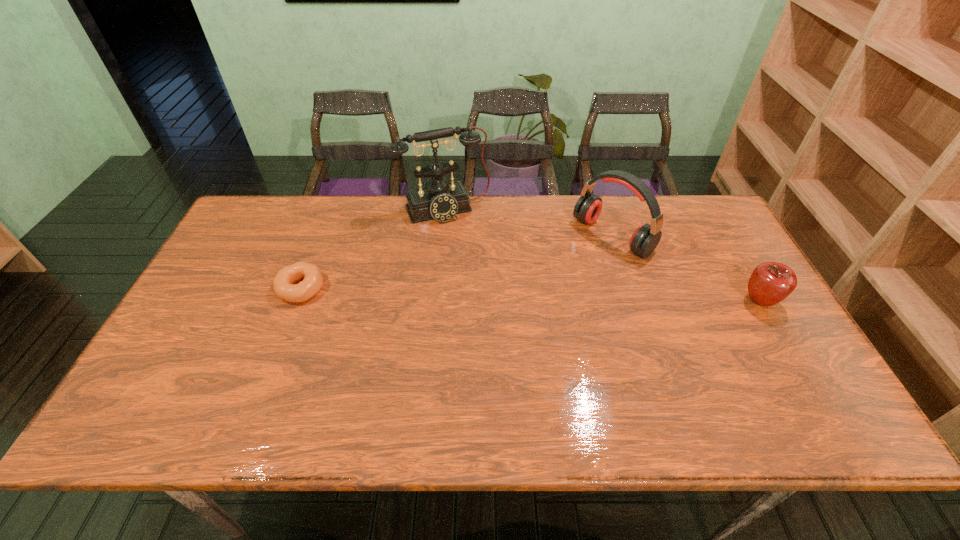
I want to click on the shortest object, so click(x=283, y=284).

Where is `doughnut`? The width and height of the screenshot is (960, 540). doughnut is located at coordinates (283, 284).

I want to click on apple, so click(771, 282).

In order to click on the third tallest object in this screenshot , I will do `click(771, 282)`.

Image resolution: width=960 pixels, height=540 pixels. Identify the location of the second tallest object. (645, 238).

Where is `earphone`? Image resolution: width=960 pixels, height=540 pixels. earphone is located at coordinates (645, 238).

This screenshot has height=540, width=960. I want to click on the second object from left to right, so point(441,200).

The image size is (960, 540). What are the coordinates of `the tallest object` in the screenshot? It's located at (441, 200).

You are a GUI agent. You are given a task and a screenshot of the screen. Output one action in this format:
    pyautogui.click(x=<x>, y=<y>)
    Task: Click on the vacant space located on the left of the shortest object
    This screenshot has width=960, height=540.
    Given the screenshot: What is the action you would take?
    pyautogui.click(x=256, y=288)

This screenshot has height=540, width=960. I want to click on vacant area located 0.210m on the left of the third tallest object, so click(x=664, y=301).